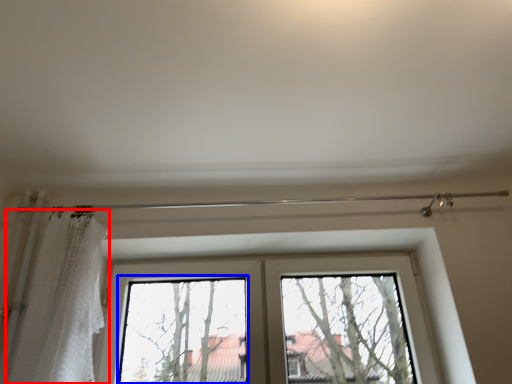
Question: Which of the following is the farthest to the observer, shower curtain (highlighted by a red box) or bay window (highlighted by a blue box)?

Choices:
 (A) shower curtain
 (B) bay window

Answer: (B)